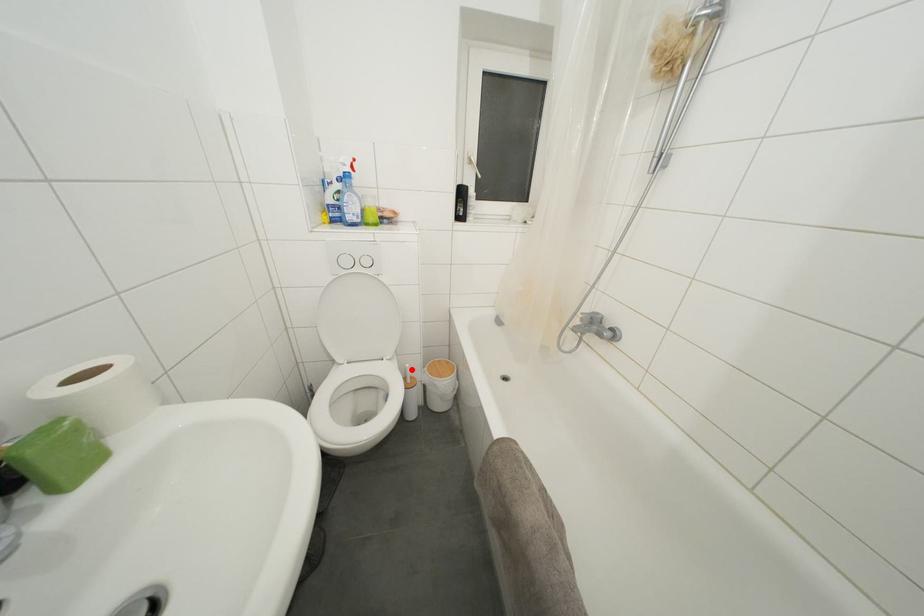
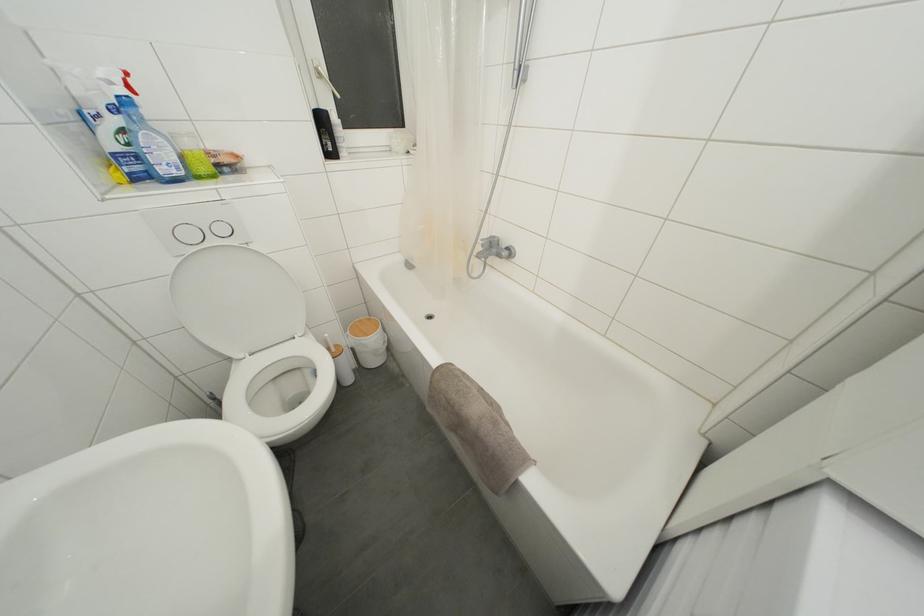
Where in the second image is the point corresponding to the highlighted location from the first image?

(331, 339)